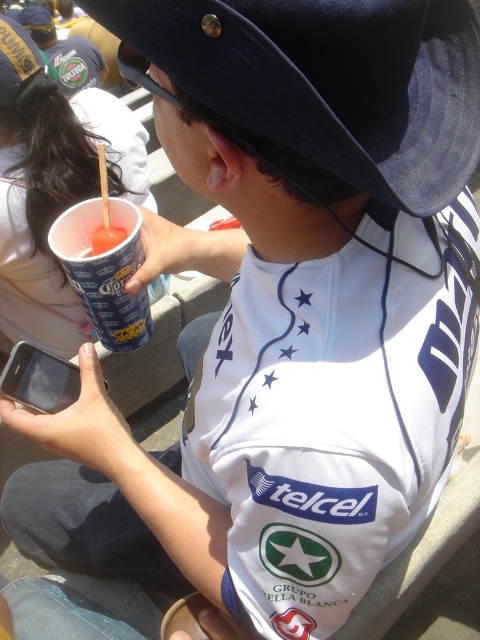
In the scene shown: You are a photographer taking a picture of the black felt baseball hat at upper center and the blue paper cup at lower left. Which object should you focus on first to ensure both are in sharp focus?

You should focus on the black felt baseball hat at upper center first because it is closer to the viewer than the blue paper cup at lower left, so adjusting focus from near to far will help both be in sharp focus.

You are a photographer at an event and need to capture a clear shot of the blue paper cup at lower left without the black felt baseball hat at upper center blocking it. Based on their positions, which direction should you move your camera to achieve this?

Since the black felt baseball hat at upper center is to the right of the blue paper cup at lower left, moving the camera to the left would position the cup away from the hat, ensuring it isn not blocked.